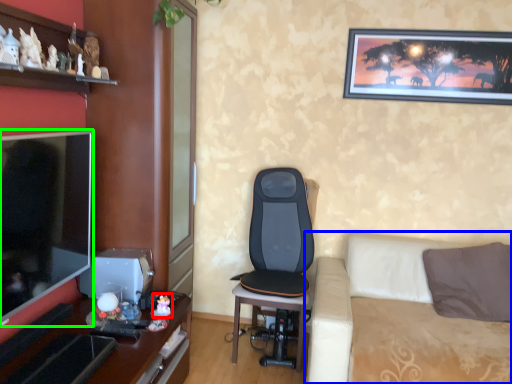
Question: Which object is the closest to the toy (highlighted by a red box)? Choose among these: studio couch (highlighted by a blue box) or television (highlighted by a green box).

Choices:
 (A) studio couch
 (B) television

Answer: (B)